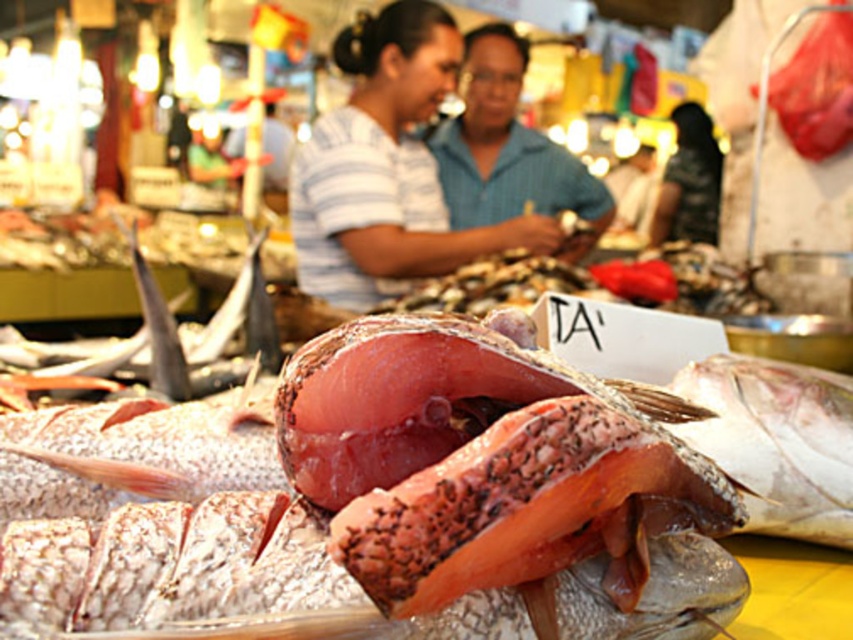
You are a customer at the fish market. You see the shiny silver fish at center and the blue striped shirt at center. Which object is closer to you?

The shiny silver fish at center is closer to you because it is positioned under the blue striped shirt at center, which means it is in front of the shirt.